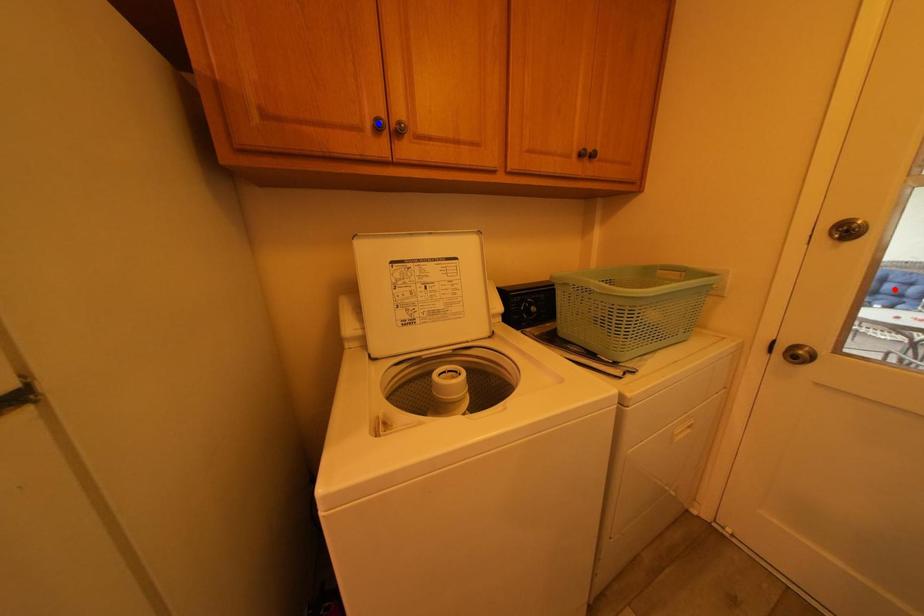
Question: Two points are marked on the image. Which point is closer to the camera?

Choices:
 (A) Blue point is closer.
 (B) Red point is closer.

Answer: (A)